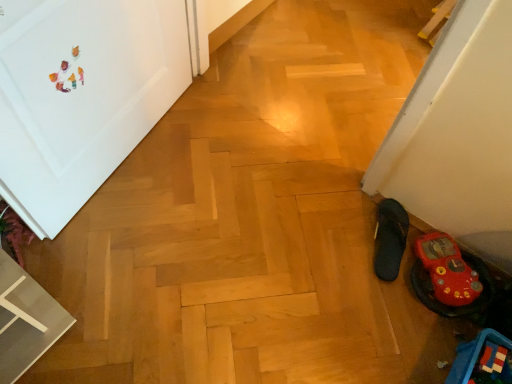
Question: Would you say rubber flip-flop at lower right, which is the 2th footwear in left-to-right order, is to the left or to the right of black fabric slipper at lower right, positioned as the 1th footwear in left-to-right order, in the picture?

Choices:
 (A) right
 (B) left

Answer: (A)

Question: Does point (455, 253) appear closer or farther from the camera than point (399, 248)?

Choices:
 (A) closer
 (B) farther

Answer: (A)

Question: Which is farther from the black fabric slipper at lower right, positioned as the 1th footwear in left-to-right order?

Choices:
 (A) rubber flip-flop at lower right, which is the 2th footwear in left-to-right order
 (B) blue plastic toy at lower right
 (C) white matte door at upper left

Answer: (C)

Question: Which object is the farthest from the blue plastic toy at lower right?

Choices:
 (A) white matte door at upper left
 (B) rubber flip-flop at lower right, acting as the 1th footwear starting from the right
 (C) black fabric slipper at lower right, positioned as the 1th footwear in left-to-right order

Answer: (A)